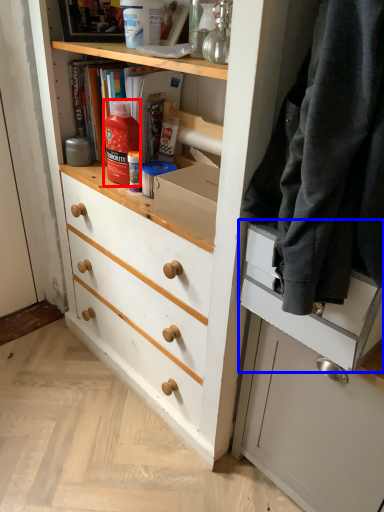
Question: Which object is closer to the camera taking this photo, bottle (highlighted by a red box) or drawer (highlighted by a blue box)?

Choices:
 (A) bottle
 (B) drawer

Answer: (B)